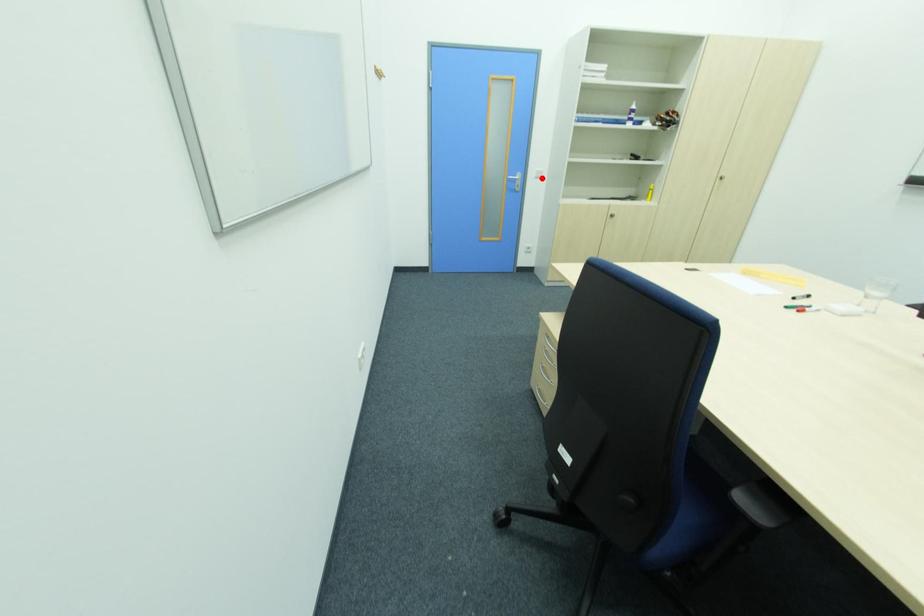
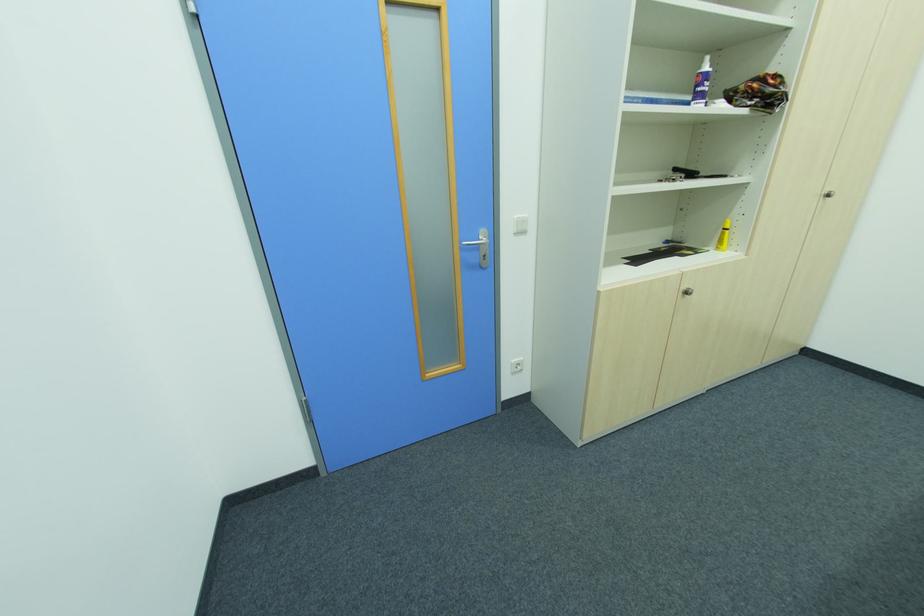
Where in the second image is the point corresponding to the highlighted location from the first image?

(525, 233)